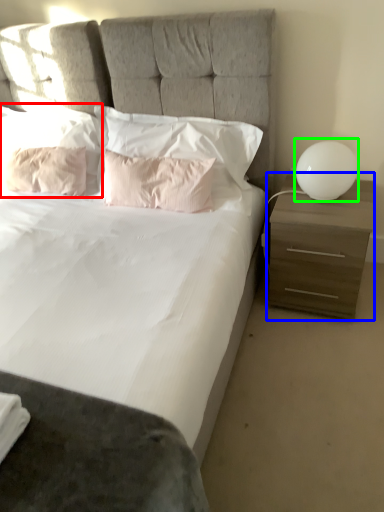
Question: Which is nearer to the pillow (highlighted by a red box)? nightstand (highlighted by a blue box) or table lamp (highlighted by a green box).

Choices:
 (A) nightstand
 (B) table lamp

Answer: (A)